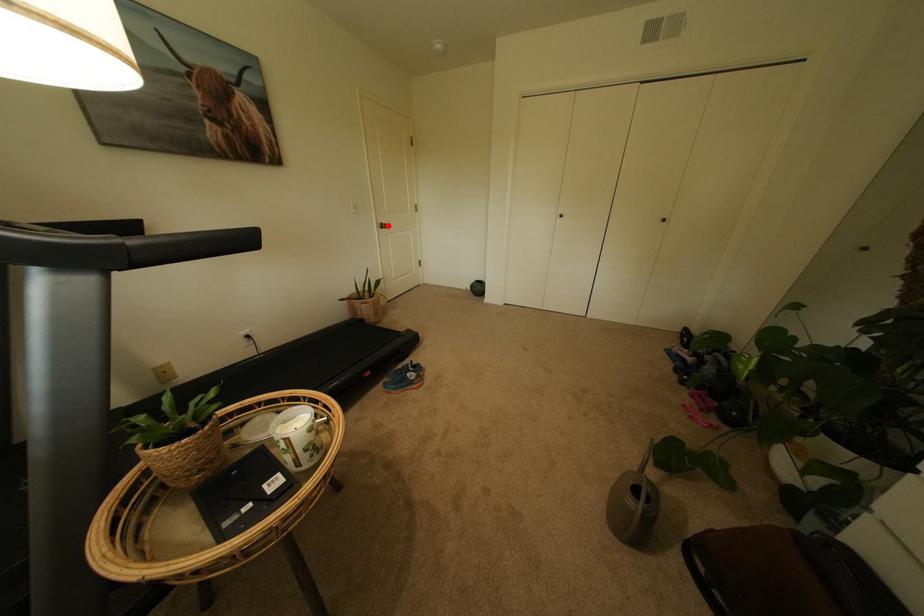
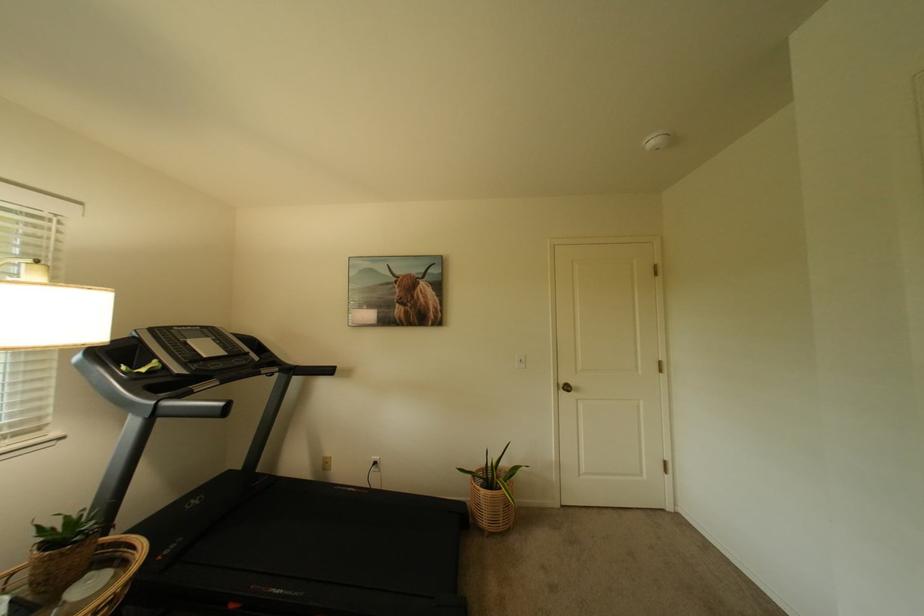
Question: I am providing you with two images of the same scene from different viewpoints. A red point is shown in image1. For the corresponding object point in image2, is it positioned nearer or farther from the camera?

Choices:
 (A) Nearer
 (B) Farther

Answer: (B)